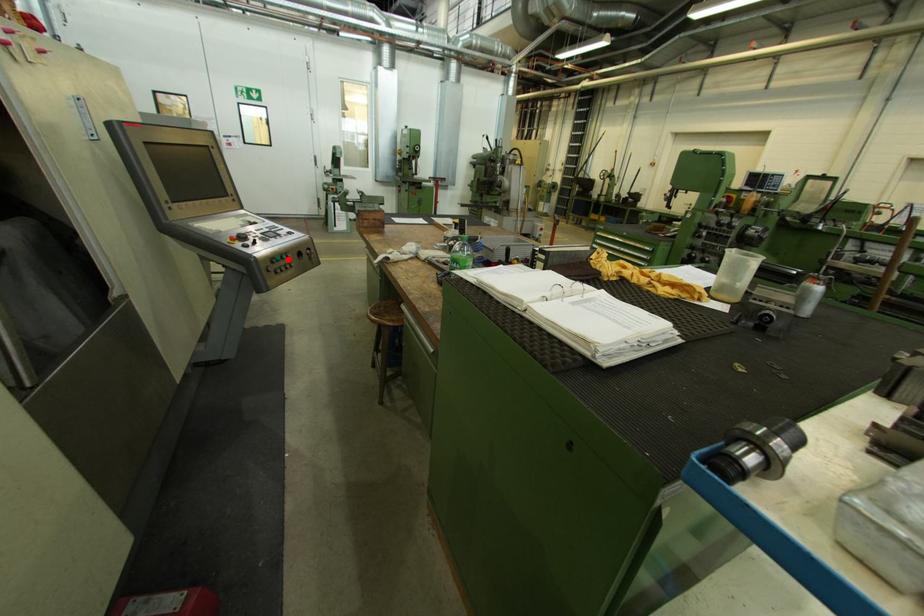
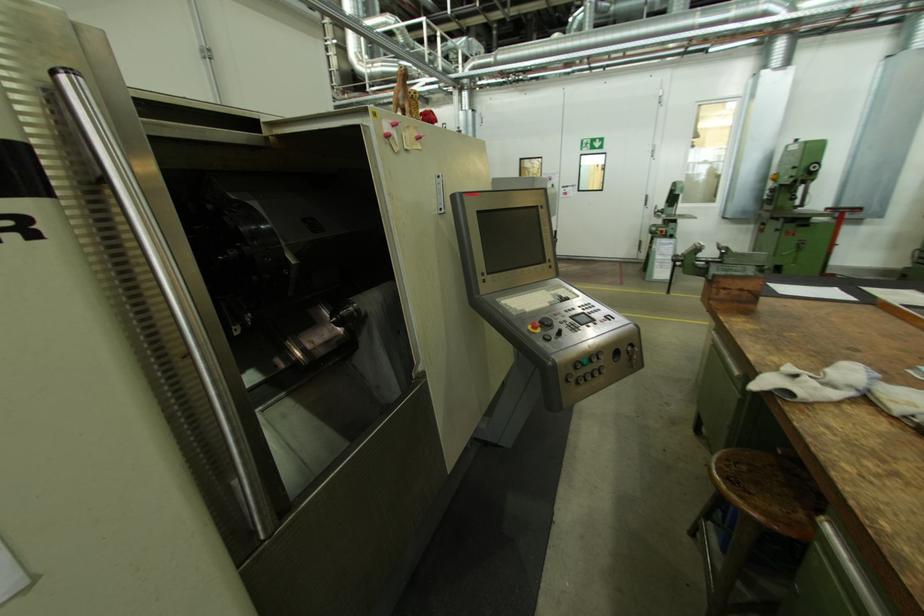
Where in the second image is the point corresponding to the highlighted location from the first image?

(596, 362)